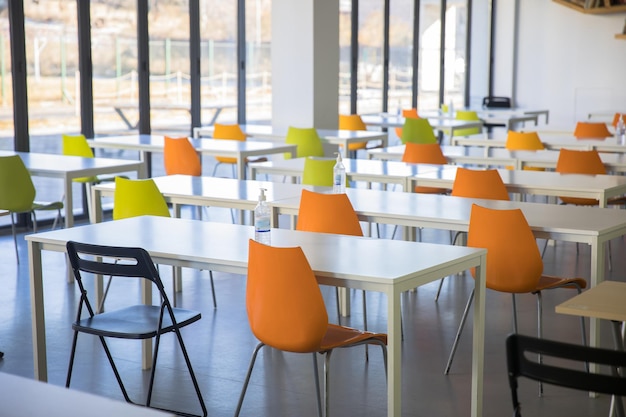
The width and height of the screenshot is (626, 417). I want to click on orange chairs, so click(288, 267), click(180, 163), click(330, 211), click(503, 228), click(476, 182), click(427, 156), click(412, 113), click(585, 163), click(583, 128), click(618, 120).